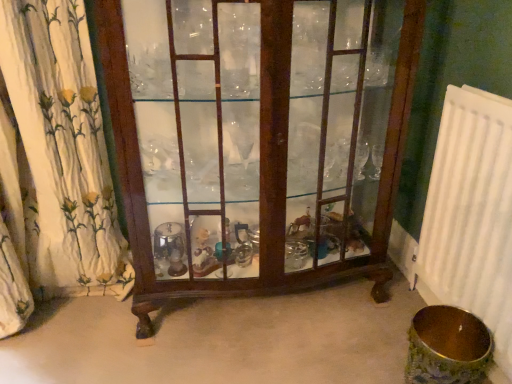
The image size is (512, 384). Identify the location of vacant space in front of white floral fabric at left. (49, 359).